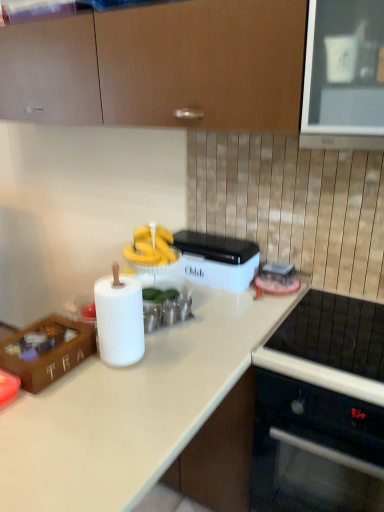
Question: Does white matte countertop at center have a larger size compared to wooden tea box at lower left?

Choices:
 (A) no
 (B) yes

Answer: (B)

Question: Is white matte countertop at center not close to wooden tea box at lower left?

Choices:
 (A) no
 (B) yes

Answer: (A)

Question: Considering the relative sizes of white matte countertop at center and wooden tea box at lower left in the image provided, is white matte countertop at center shorter than wooden tea box at lower left?

Choices:
 (A) yes
 (B) no

Answer: (B)

Question: Is white matte countertop at center positioned with its back to wooden tea box at lower left?

Choices:
 (A) yes
 (B) no

Answer: (B)

Question: Is white matte countertop at center to the right of wooden tea box at lower left from the viewer's perspective?

Choices:
 (A) yes
 (B) no

Answer: (A)

Question: Is white matte countertop at center smaller than wooden tea box at lower left?

Choices:
 (A) no
 (B) yes

Answer: (A)

Question: From the image's perspective, is white plastic container at center located beneath matte wood cabinets at upper center?

Choices:
 (A) yes
 (B) no

Answer: (A)

Question: Does white plastic container at center appear on the right side of matte wood cabinets at upper center?

Choices:
 (A) yes
 (B) no

Answer: (A)

Question: Is matte wood cabinets at upper center surrounded by white plastic container at center?

Choices:
 (A) yes
 (B) no

Answer: (B)

Question: Are white plastic container at center and matte wood cabinets at upper center beside each other?

Choices:
 (A) yes
 (B) no

Answer: (B)

Question: Is white plastic container at center behind matte wood cabinets at upper center?

Choices:
 (A) no
 (B) yes

Answer: (B)

Question: From the image's perspective, is white plastic container at center above matte wood cabinets at upper center?

Choices:
 (A) yes
 (B) no

Answer: (B)

Question: Is matte wood cabinets at upper center aimed at white plastic container at center?

Choices:
 (A) yes
 (B) no

Answer: (B)